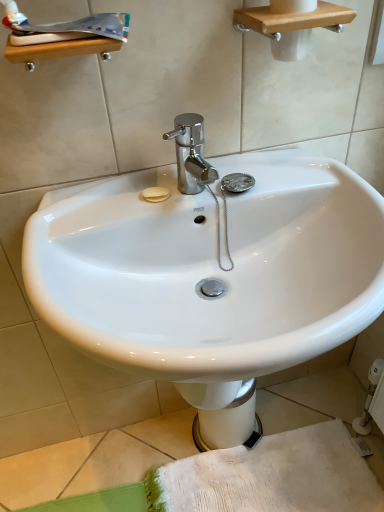
Locate an element on the screen. free point to the left of white glossy bidet at center is located at coordinates (165, 448).